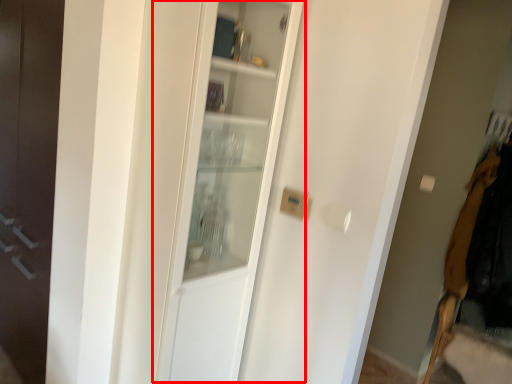
Question: From the image's perspective, considering the relative positions of cabinetry (annotated by the red box) and clothing in the image provided, where is cabinetry (annotated by the red box) located with respect to the staircase?

Choices:
 (A) above
 (B) below

Answer: (A)